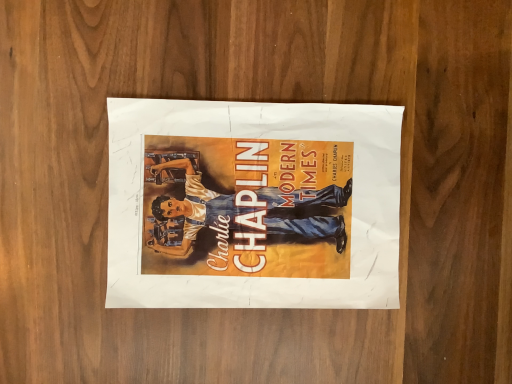
What is the approximate width of matte paper poster at center?

matte paper poster at center is 12.31 inches wide.

Locate an element on the screen. This screenshot has width=512, height=384. matte paper poster at center is located at coordinates (253, 205).

The image size is (512, 384). Describe the element at coordinates (253, 205) in the screenshot. I see `matte paper poster at center` at that location.

At what (x,y) coordinates should I click in order to perform the action: click on matte paper poster at center. Please return your answer as a coordinate pair (x, y). The image size is (512, 384). Looking at the image, I should click on (253, 205).